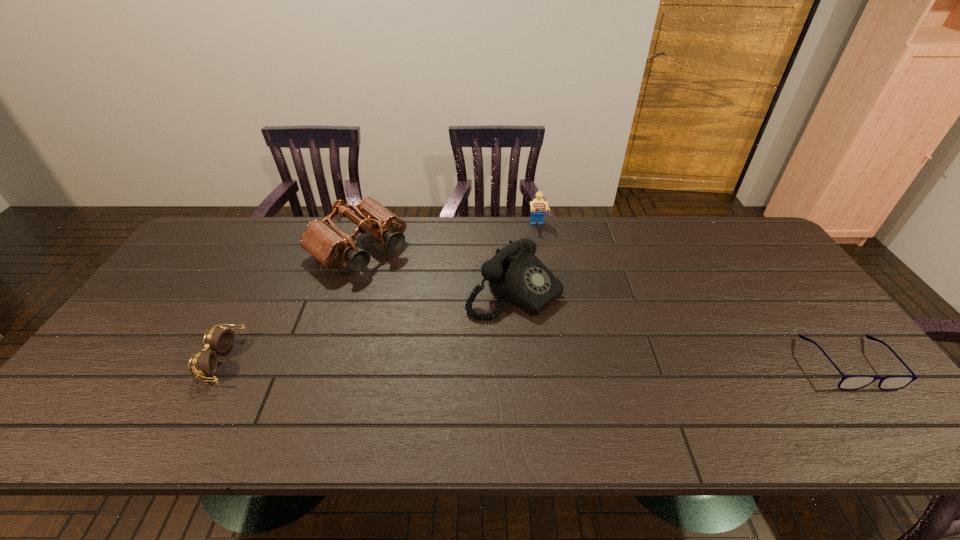
Locate an element on the screen. The image size is (960, 540). free space on the desktop that is between the leftmost object and the spectacles and is positioned on the dial of the telephone is located at coordinates (624, 362).

Where is `vacant spot on the desktop that is between the goggles and the rightmost object and is positioned through the eyepieces of the second object from left to right`? vacant spot on the desktop that is between the goggles and the rightmost object and is positioned through the eyepieces of the second object from left to right is located at coordinates (497, 361).

I want to click on vacant space on the desktop that is between the leftmost object and the spectacles and is positioned on the face of the Lego, so click(564, 361).